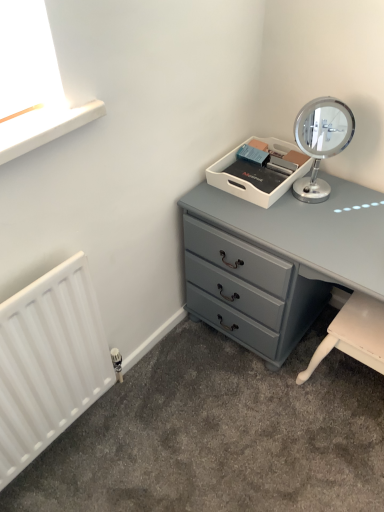
You are a GUI agent. You are given a task and a screenshot of the screen. Output one action in this format:
    pyautogui.click(x=<x>, y=<y>)
    Task: Click on the vacant space to the right of white matte radiator at lower left
    The image size is (384, 512).
    Given the screenshot: What is the action you would take?
    pyautogui.click(x=148, y=434)